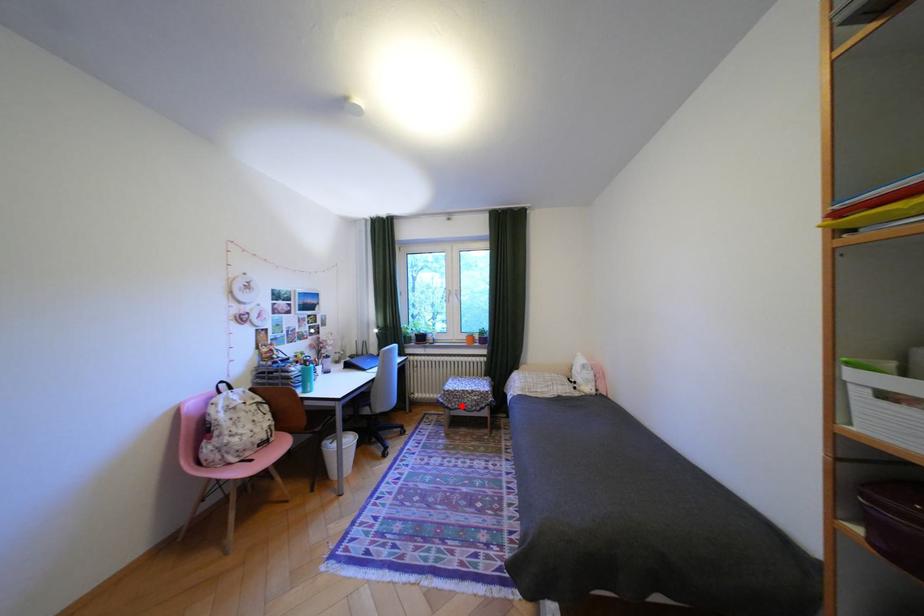
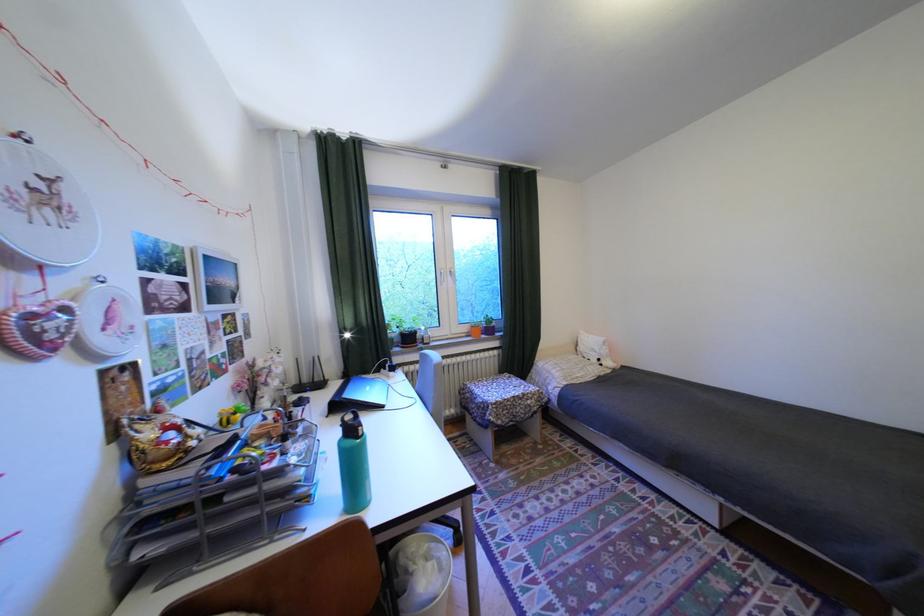
Question: I am providing you with two images of the same scene from different viewpoints. A red point is marked on the first image. Is the red point's position out of view in image 2?

Choices:
 (A) Yes
 (B) No

Answer: (B)